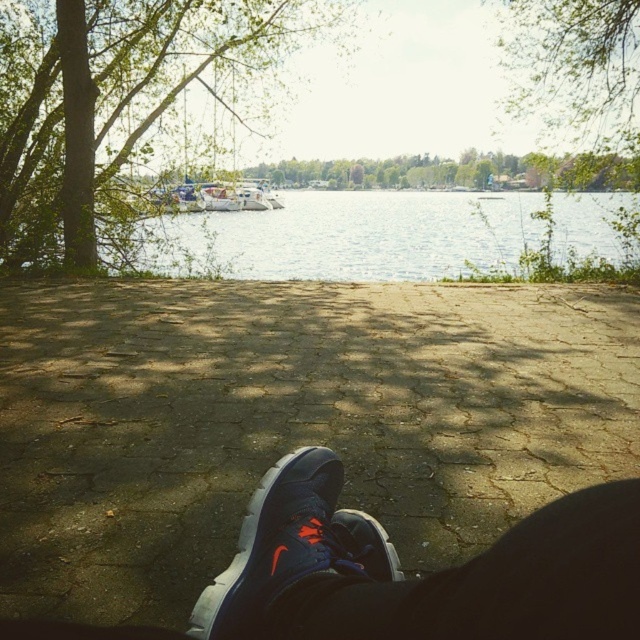
Question: Which of the following is the farthest from the observer?

Choices:
 (A) green leafy tree at upper left
 (B) white glossy boat at center
 (C) clear water at center

Answer: (B)

Question: Which of the following is the closest to the observer?

Choices:
 (A) matte blue shoe at lower center
 (B) white glossy boat at center

Answer: (A)

Question: Which point is closer to the camera?

Choices:
 (A) matte blue shoe at lower center
 (B) clear water at center

Answer: (A)

Question: Can you confirm if green leafy tree at upper left is positioned to the right of matte blue shoe at lower center?

Choices:
 (A) yes
 (B) no

Answer: (B)

Question: Is green leafy tree at upper left behind clear water at center?

Choices:
 (A) no
 (B) yes

Answer: (B)

Question: Observing the image, what is the correct spatial positioning of green leafy tree at upper left in reference to clear water at center?

Choices:
 (A) right
 (B) left

Answer: (B)